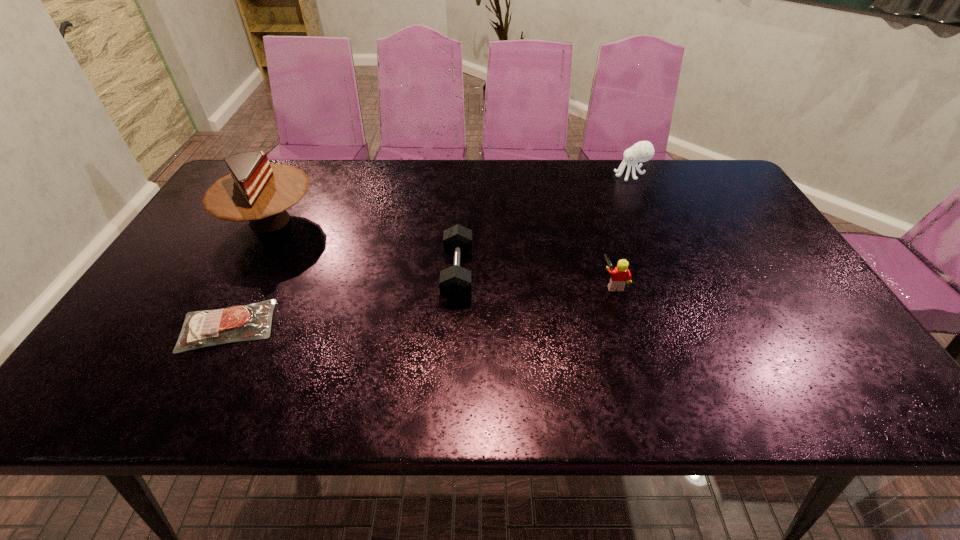
Where is `blank region between the third object from left to right and the cake`? blank region between the third object from left to right and the cake is located at coordinates (364, 247).

At what (x,y) coordinates should I click in order to perform the action: click on free space that is in between the tallest object and the third object from left to right. Please return your answer as a coordinate pair (x, y). Image resolution: width=960 pixels, height=540 pixels. Looking at the image, I should click on (364, 247).

The width and height of the screenshot is (960, 540). I want to click on unoccupied position between the octopus and the cake, so click(x=450, y=198).

At what (x,y) coordinates should I click in order to perform the action: click on vacant area between the rightmost object and the Lego. Please return your answer as a coordinate pair (x, y). Looking at the image, I should click on (622, 230).

Identify the location of vacant area that lies between the octopus and the Lego. The image size is (960, 540). (622, 230).

Point out which object is positioned as the third nearest to the Lego. Please provide its 2D coordinates. Your answer should be formatted as a tuple, i.e. [(x, y)], where the tuple contains the x and y coordinates of a point satisfying the conditions above.

[(237, 323)]

Point out which object is positioned as the second nearest to the rightmost object. Please provide its 2D coordinates. Your answer should be formatted as a tuple, i.e. [(x, y)], where the tuple contains the x and y coordinates of a point satisfying the conditions above.

[(455, 282)]

You are a GUI agent. You are given a task and a screenshot of the screen. Output one action in this format:
    pyautogui.click(x=<x>, y=<y>)
    Task: Click on the free space that satisfies the following two spatial constraints: 1. on the front-facing side of the second tallest object; 2. on the front side of the tallest object
    This screenshot has width=960, height=540.
    Given the screenshot: What is the action you would take?
    pyautogui.click(x=651, y=220)